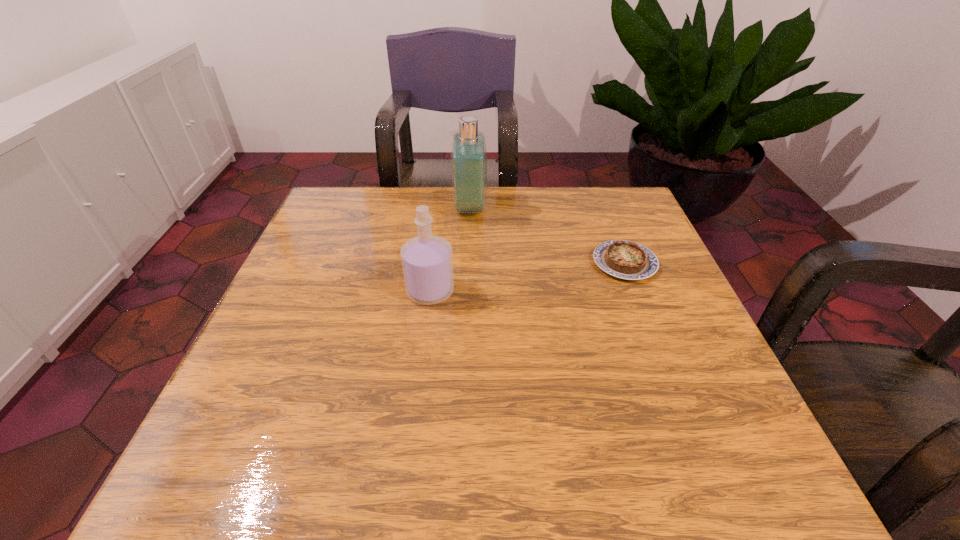
Image resolution: width=960 pixels, height=540 pixels. What are the coordinates of `vacant space at the far edge` in the screenshot? It's located at (562, 200).

The width and height of the screenshot is (960, 540). What are the coordinates of `vacant space at the near edge of the desktop` in the screenshot? It's located at (380, 445).

In the image, there is a desktop. Identify the location of vacant area at the left edge. (313, 347).

At what (x,y) coordinates should I click in order to perform the action: click on free space at the far left corner of the desktop. Please return your answer as a coordinate pair (x, y). Looking at the image, I should click on (360, 195).

This screenshot has width=960, height=540. I want to click on vacant position at the far right corner of the desktop, so click(636, 233).

Where is `vacant area that lies between the second shortest object and the rightmost object`? The image size is (960, 540). vacant area that lies between the second shortest object and the rightmost object is located at coordinates (527, 277).

Where is `vacant area between the rightmost object and the second shortest object`? The width and height of the screenshot is (960, 540). vacant area between the rightmost object and the second shortest object is located at coordinates (527, 277).

Locate an element on the screen. The height and width of the screenshot is (540, 960). blank region between the second shortest object and the quiche is located at coordinates (527, 277).

What are the coordinates of `free space between the shorter perfume and the shortest object` in the screenshot? It's located at (527, 277).

At what (x,y) coordinates should I click in order to perform the action: click on vacant space that is in between the farther perfume and the quiche. Please return your answer as a coordinate pair (x, y). Looking at the image, I should click on (547, 235).